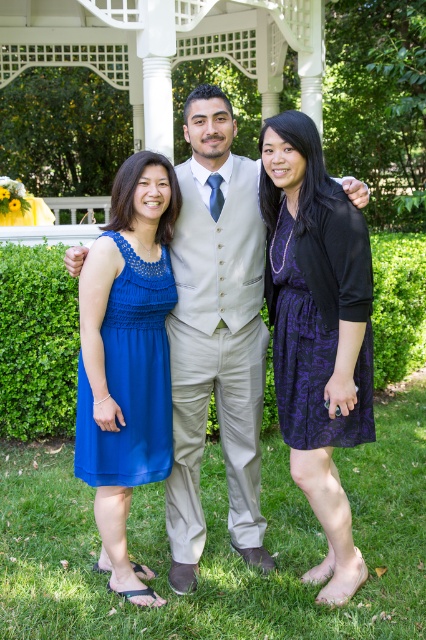
You are a photographer setting up a camera to capture the scene. You need to ensure that both the matte beige vest at center and the purple satin dress at center are fully visible in the frame. Based on their positions and sizes, which object should you prioritize positioning closer to the camera to ensure it doesn

The matte beige vest at center might be wider than the purple satin dress at center, so to ensure both are fully visible, prioritize positioning the purple satin dress at center closer to the camera since it is narrower and might be easier to frame without cropping.

You are a photographer setting up for a group photo in the garden. You need to ensure that all clothing items mentioned are visible in the frame. Given that the matte beige vest at center and the purple satin dress at center are both at the center, which clothing item might require more space in the frame?

The matte beige vest at center is larger in size than the purple satin dress at center, so it would require more space in the frame to ensure it is fully visible.